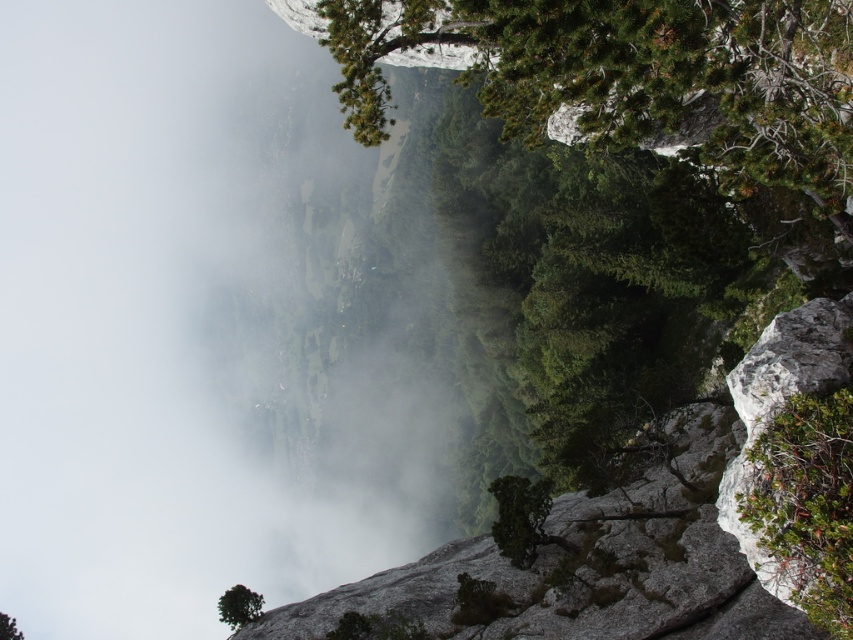
You are a hiker planning to take a photo of the white misty fog at upper left and the green leafy tree at upper center. Which object should you focus on first if you want to capture both in a single frame without moving the camera?

You should focus on the white misty fog at upper left first because it is wider than the green leafy tree at upper center, allowing you to frame it properly before adjusting for the tree.

You are a hiker trying to navigate through the valley. You see the white misty fog at upper left and the green leafy shrub at right. Which object is higher in elevation from your current viewpoint?

The white misty fog at upper left is taller than the green leafy shrub at right, so the white misty fog at upper left is higher in elevation from your current viewpoint.